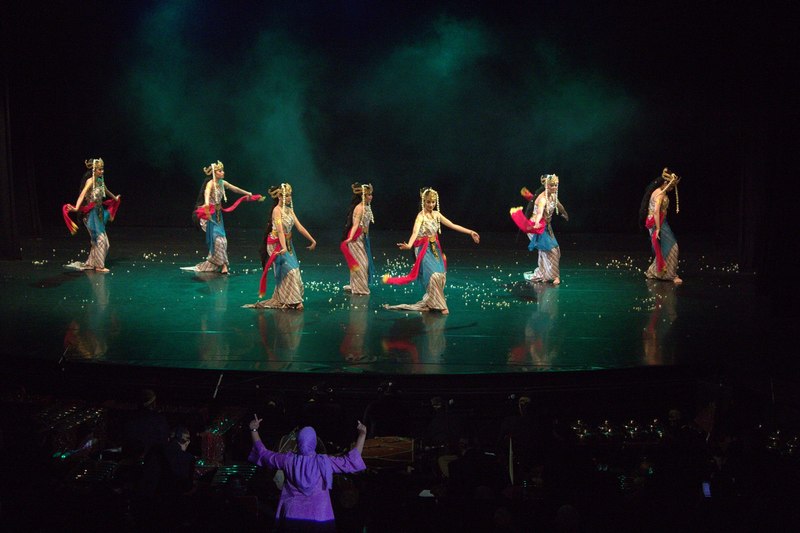
Find the location of a particular element. This screenshot has width=800, height=533. stage backdrop is located at coordinates (362, 118), (666, 106), (134, 85).